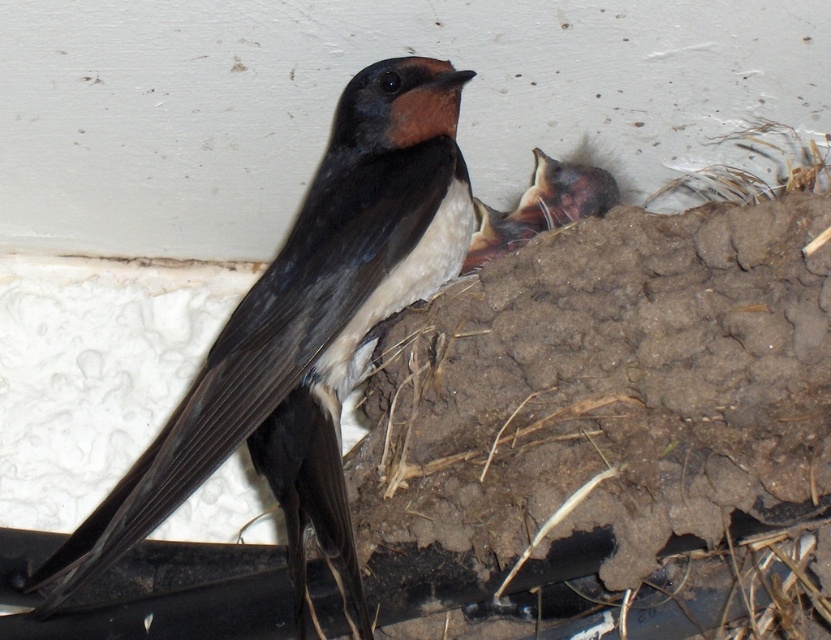
Does point (306, 397) lie in front of point (549, 212)?

Yes, point (306, 397) is closer to viewer.

Can you confirm if matte black bird at center is wider than brown feathered bird at center?

Indeed, matte black bird at center has a greater width compared to brown feathered bird at center.

What do you see at coordinates (308, 330) in the screenshot?
I see `matte black bird at center` at bounding box center [308, 330].

Find the location of a particular element. The width and height of the screenshot is (831, 640). matte black bird at center is located at coordinates (308, 330).